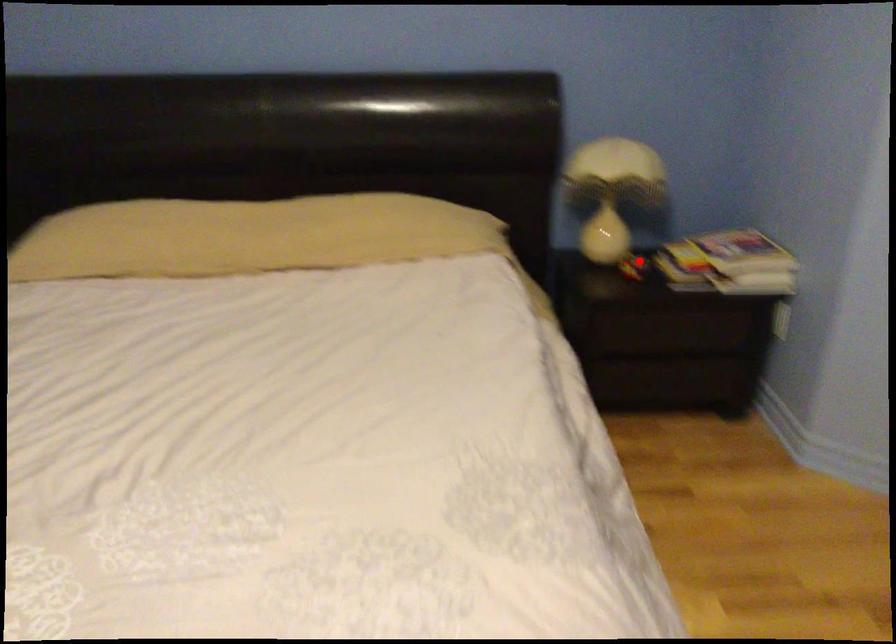
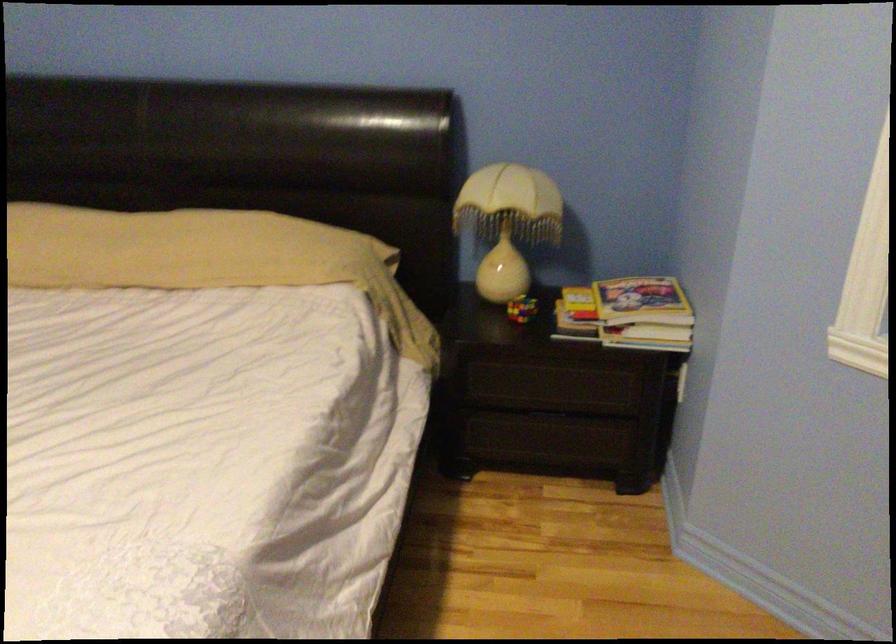
Question: I am providing you with two images of the same scene from different viewpoints. A red point is marked on the first image. Can you still see the location of the red point in image 2?

Choices:
 (A) Yes
 (B) No

Answer: (A)